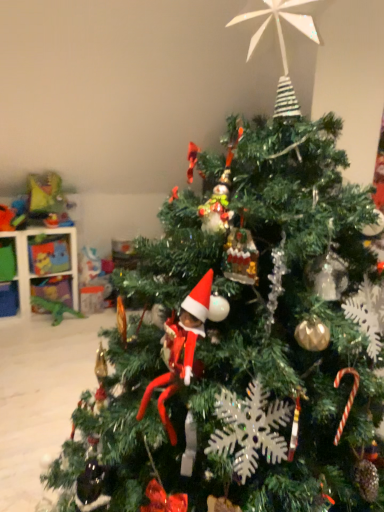
Question: Should I look upward or downward to see green plastic dinosaur at lower left, the 2th toy positioned from the top?

Choices:
 (A) down
 (B) up

Answer: (A)

Question: Is the position of white plastic shelf at left more distant than that of green plastic dinosaur at lower left, marked as the first toy in a bottom-to-top arrangement?

Choices:
 (A) yes
 (B) no

Answer: (B)

Question: Is there a large distance between white plastic shelf at left and green plastic dinosaur at lower left, marked as the first toy in a bottom-to-top arrangement?

Choices:
 (A) no
 (B) yes

Answer: (A)

Question: Is white plastic shelf at left aimed at green plastic dinosaur at lower left, the 2th toy positioned from the top?

Choices:
 (A) yes
 (B) no

Answer: (A)

Question: Can green plastic dinosaur at lower left, marked as the first toy in a bottom-to-top arrangement, be found inside white plastic shelf at left?

Choices:
 (A) no
 (B) yes

Answer: (A)

Question: From a real-world perspective, is white plastic shelf at left located beneath green plastic dinosaur at lower left, the 2th toy positioned from the top?

Choices:
 (A) no
 (B) yes

Answer: (A)

Question: Considering the relative sizes of white plastic shelf at left and green plastic dinosaur at lower left, the 2th toy positioned from the top, in the image provided, is white plastic shelf at left smaller than green plastic dinosaur at lower left, the 2th toy positioned from the top,?

Choices:
 (A) no
 (B) yes

Answer: (A)

Question: Does white plastic shelf at left appear on the left side of plastic dinosaur at upper left, the first toy viewed from the top?

Choices:
 (A) no
 (B) yes

Answer: (B)

Question: Considering the relative sizes of white plastic shelf at left and plastic dinosaur at upper left, the first toy viewed from the top, in the image provided, is white plastic shelf at left bigger than plastic dinosaur at upper left, the first toy viewed from the top,?

Choices:
 (A) no
 (B) yes

Answer: (B)

Question: Are white plastic shelf at left and plastic dinosaur at upper left, the first toy viewed from the top, far apart?

Choices:
 (A) no
 (B) yes

Answer: (A)

Question: Considering the relative positions of white plastic shelf at left and plastic dinosaur at upper left, which ranks as the second toy in bottom-to-top order, in the image provided, is white plastic shelf at left in front of plastic dinosaur at upper left, which ranks as the second toy in bottom-to-top order,?

Choices:
 (A) yes
 (B) no

Answer: (A)

Question: From a real-world perspective, is white plastic shelf at left physically below plastic dinosaur at upper left, which ranks as the second toy in bottom-to-top order?

Choices:
 (A) no
 (B) yes

Answer: (B)

Question: Is white plastic shelf at left completely or partially outside of plastic dinosaur at upper left, which ranks as the second toy in bottom-to-top order?

Choices:
 (A) no
 (B) yes

Answer: (B)

Question: From the image's perspective, is green plastic dinosaur at lower left, the 2th toy positioned from the top, beneath white plastic shelf at left?

Choices:
 (A) yes
 (B) no

Answer: (A)